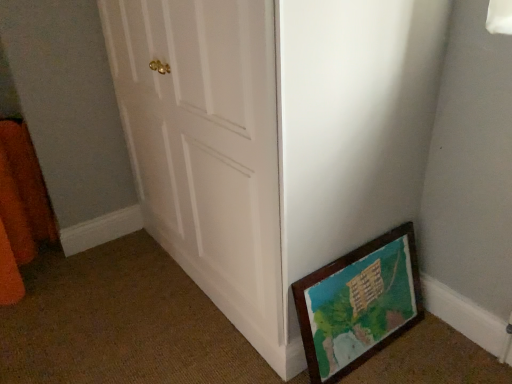
Locate an element on the screen. Image resolution: width=512 pixels, height=384 pixels. vacant space underneath orange fuzzy curtain at left (from a real-world perspective) is located at coordinates (42, 260).